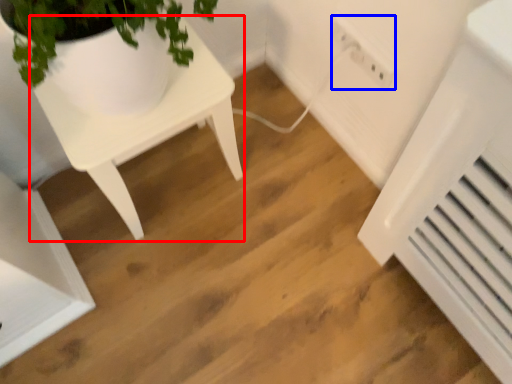
Question: Which point is closer to the camera, table (highlighted by a red box) or electric outlet (highlighted by a blue box)?

Choices:
 (A) table
 (B) electric outlet

Answer: (A)